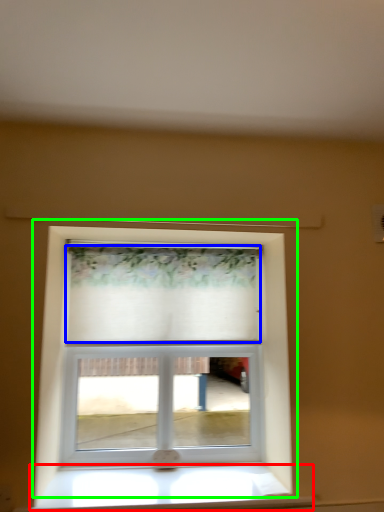
Question: Considering the real-world distances, which object is closest to window sill (highlighted by a red box)? curtain (highlighted by a blue box) or window (highlighted by a green box).

Choices:
 (A) curtain
 (B) window

Answer: (B)